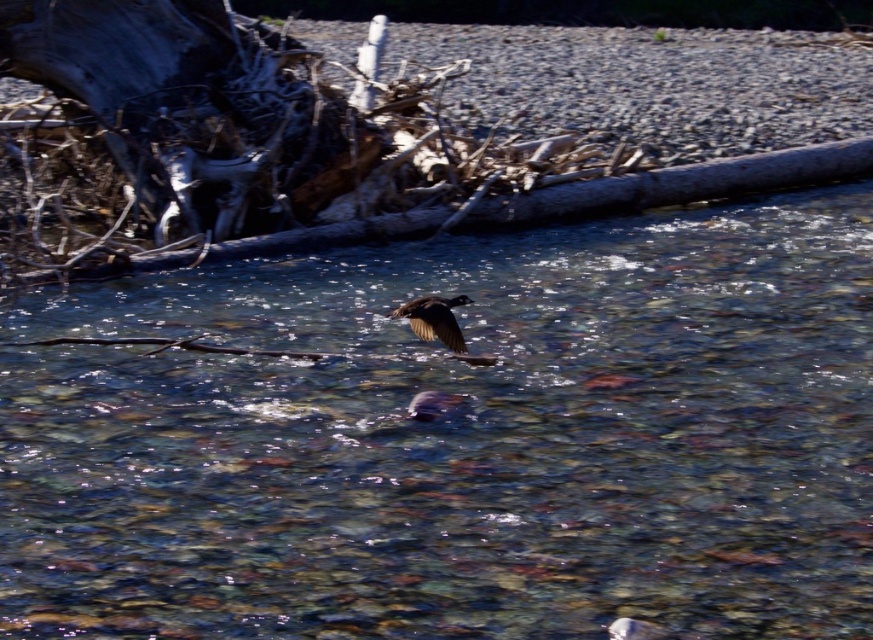
You are standing on the riverbank and see the clear water at center and the dark brown feathers at center. Which object is closer to you?

The clear water at center is closer to you because it is in front of the dark brown feathers at center.

You are an ornithologist observing the bird in flight over the riverbed. You notice the clear water at center and the dark brown feathers at center. Which object is positioned to the right of the other?

The clear water at center is to the left of dark brown feathers at center, so the dark brown feathers at center are positioned to the right of the clear water at center.

You are a nature photographer observing the scene. You notice the clear water at center and the dark brown feathers at center. Based on their positions, which one is closer to the surface of the water?

The clear water at center is located above the dark brown feathers at center, meaning the clear water at center is closer to the surface of the water.